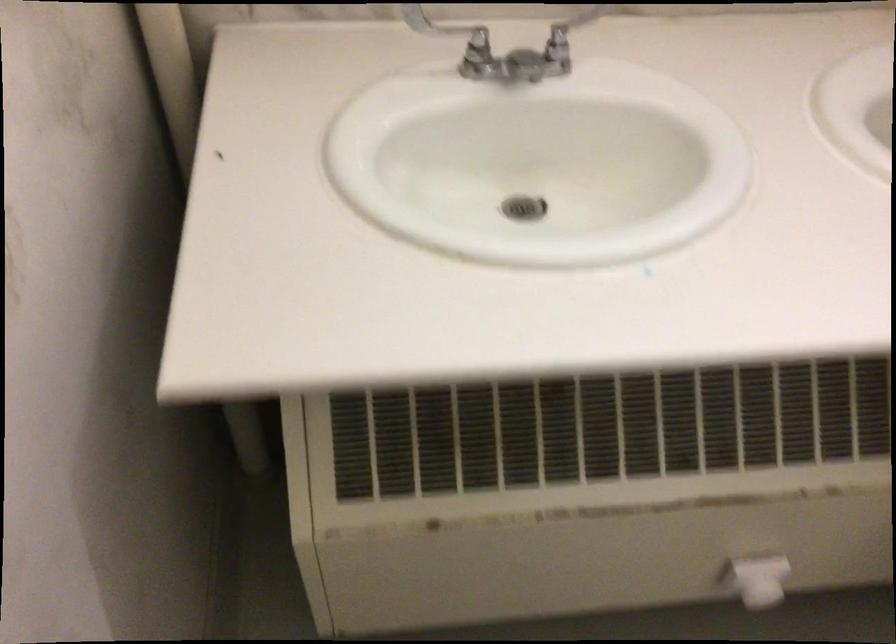
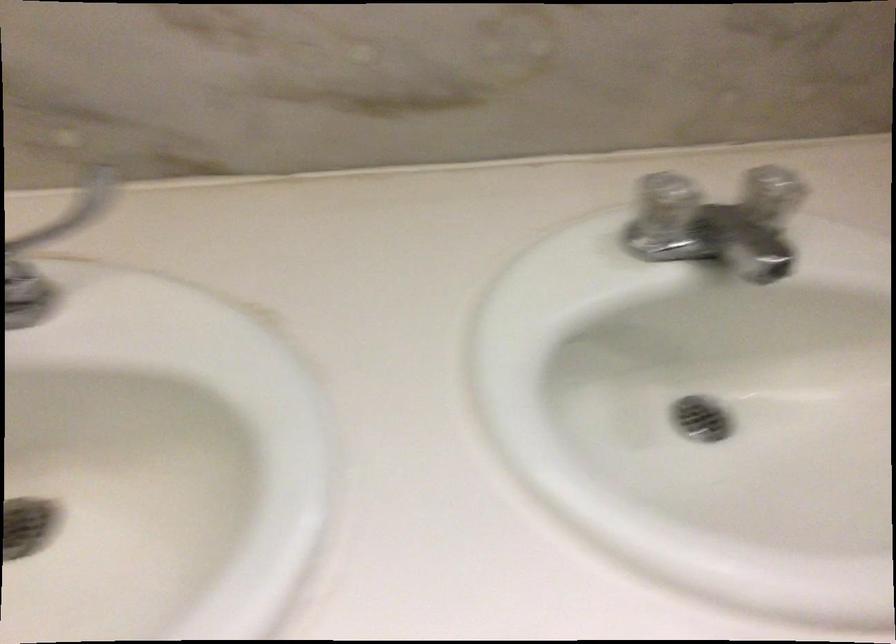
Question: How did the camera likely rotate?

Choices:
 (A) Left
 (B) Right
 (C) Up
 (D) Down

Answer: (B)